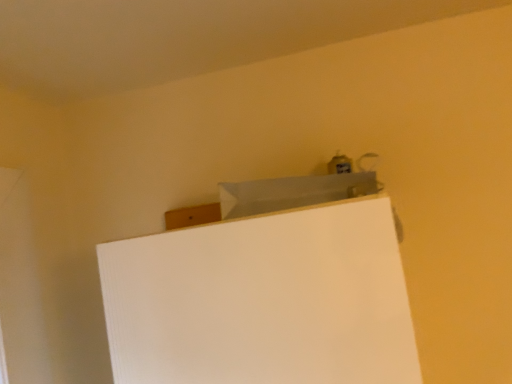
The image size is (512, 384). Describe the element at coordinates (263, 300) in the screenshot. I see `white cardboard at upper center` at that location.

Image resolution: width=512 pixels, height=384 pixels. I want to click on white cardboard at upper center, so click(263, 300).

Locate an element on the screen. The image size is (512, 384). white cardboard at upper center is located at coordinates (263, 300).